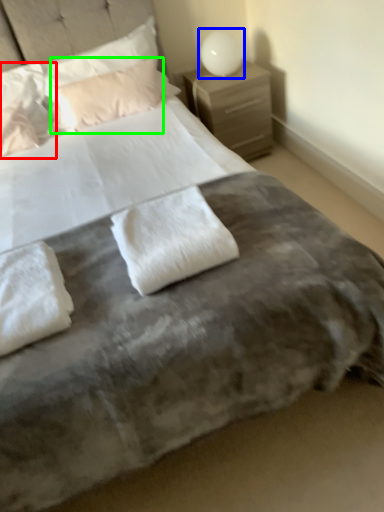
Question: Which object is positioned closest to pillow (highlighted by a red box)? Select from bedside lamp (highlighted by a blue box) and pillow (highlighted by a green box).

Choices:
 (A) bedside lamp
 (B) pillow

Answer: (B)